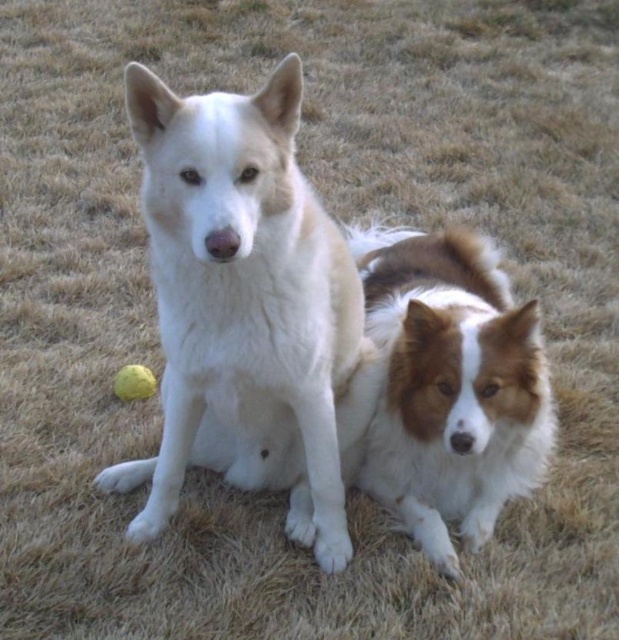
You are standing in front of the two dogs and want to throw a ball to the closest point between them. Which point should you aim for, point A at coordinates point (x=227, y=340) or point B at coordinates point (x=511, y=449)?

You should aim for point A at coordinates point (x=227, y=340) because it is closer to the viewer than point B at coordinates point (x=511, y=449).